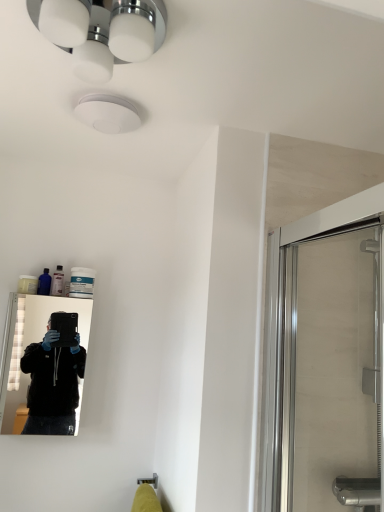
Question: Should I look upward or downward to see translucent plastic bottle at upper left?

Choices:
 (A) up
 (B) down

Answer: (B)

Question: From a real-world perspective, is translucent plastic bottle at upper left under white glossy light fixture at upper center?

Choices:
 (A) yes
 (B) no

Answer: (A)

Question: Is white glossy light fixture at upper center surrounded by translucent plastic bottle at upper left?

Choices:
 (A) no
 (B) yes

Answer: (A)

Question: From the image's perspective, does translucent plastic bottle at upper left appear lower than white glossy light fixture at upper center?

Choices:
 (A) yes
 (B) no

Answer: (A)

Question: Are translucent plastic bottle at upper left and white glossy light fixture at upper center far apart?

Choices:
 (A) yes
 (B) no

Answer: (B)

Question: Is translucent plastic bottle at upper left next to white glossy light fixture at upper center?

Choices:
 (A) no
 (B) yes

Answer: (A)

Question: Is white glossy light fixture at upper center at the back of translucent plastic bottle at upper left?

Choices:
 (A) yes
 (B) no

Answer: (B)

Question: Does black glossy mirror at left have a greater height compared to translucent plastic bottle at upper left?

Choices:
 (A) no
 (B) yes

Answer: (B)

Question: Is black glossy mirror at left next to translucent plastic bottle at upper left?

Choices:
 (A) yes
 (B) no

Answer: (B)

Question: Does black glossy mirror at left appear on the right side of translucent plastic bottle at upper left?

Choices:
 (A) yes
 (B) no

Answer: (B)

Question: From a real-world perspective, is black glossy mirror at left positioned over translucent plastic bottle at upper left based on gravity?

Choices:
 (A) no
 (B) yes

Answer: (A)

Question: Is black glossy mirror at left not near translucent plastic bottle at upper left?

Choices:
 (A) yes
 (B) no

Answer: (A)

Question: Is translucent plastic bottle at upper left inside black glossy mirror at left?

Choices:
 (A) yes
 (B) no

Answer: (B)

Question: Would you say white glossy light fixture at upper center is outside black glossy mirror at left?

Choices:
 (A) no
 (B) yes

Answer: (B)